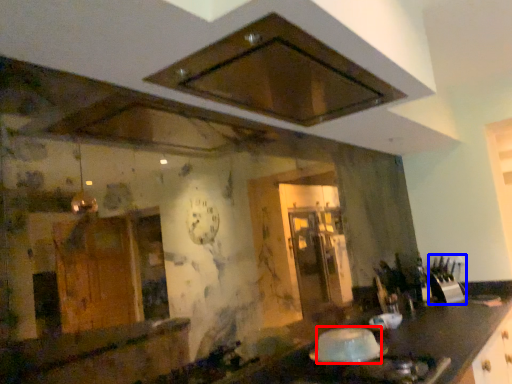
Question: Which point is closer to the camera, food (highlighted by a red box) or appliance (highlighted by a blue box)?

Choices:
 (A) food
 (B) appliance

Answer: (A)